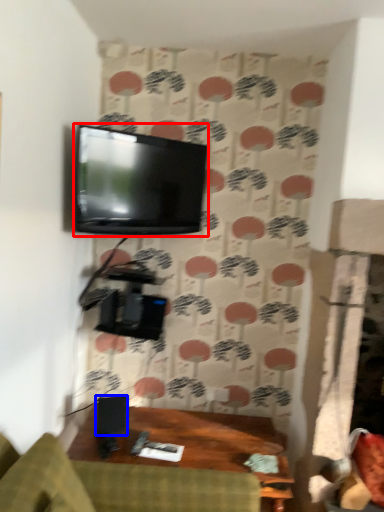
Question: Which object is closer to the camera taking this photo, television (highlighted by a red box) or speaker (highlighted by a blue box)?

Choices:
 (A) television
 (B) speaker

Answer: (A)